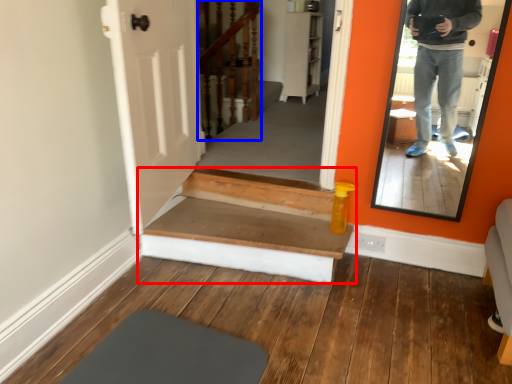
Question: Which of the following is the farthest to the observer, stairs (highlighted by a red box) or stairwell (highlighted by a blue box)?

Choices:
 (A) stairs
 (B) stairwell

Answer: (B)